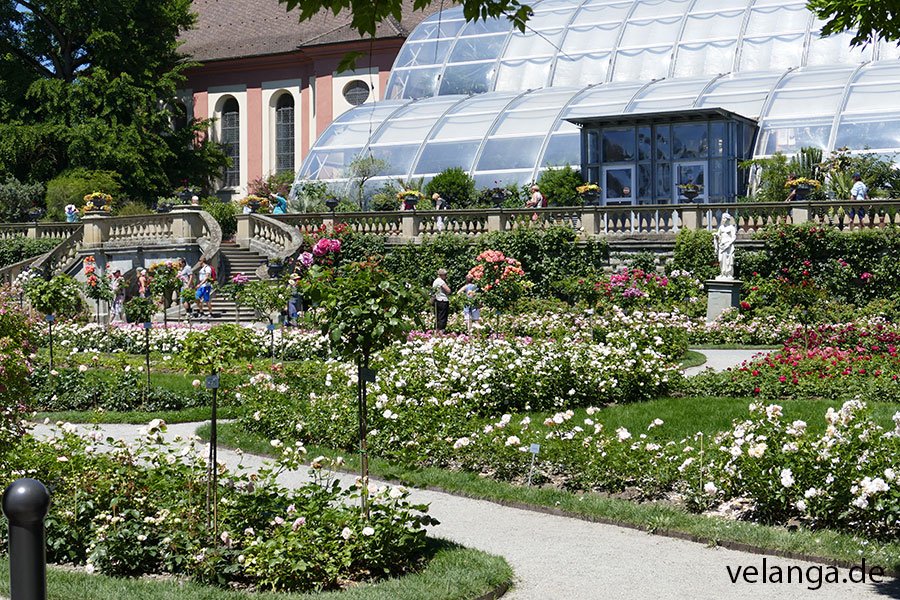
The height and width of the screenshot is (600, 900). Find the location of `archway`. archway is located at coordinates (221, 124), (275, 114), (352, 94).